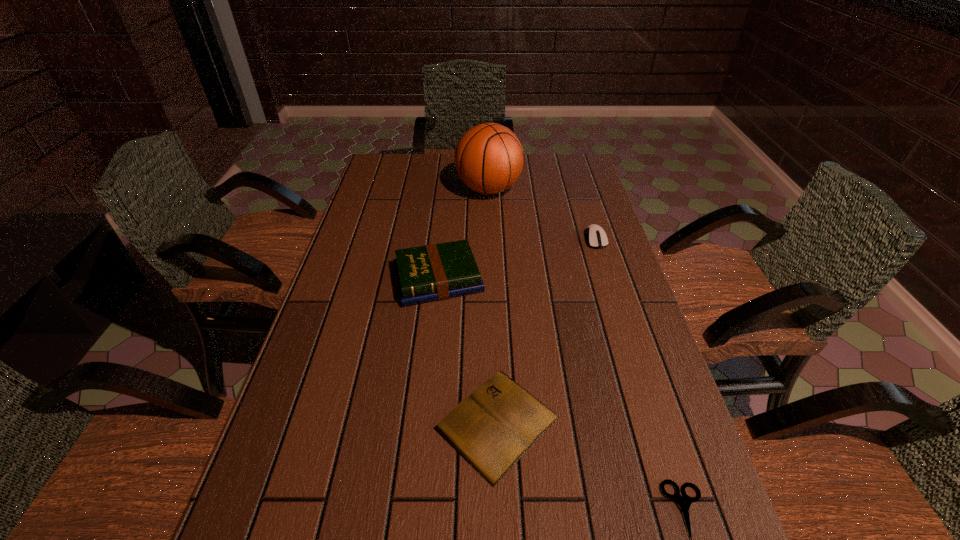
Image resolution: width=960 pixels, height=540 pixels. Identify the location of the tallest object. [x=489, y=158].

The width and height of the screenshot is (960, 540). I want to click on basketball, so click(489, 158).

The height and width of the screenshot is (540, 960). In order to click on the taller book in this screenshot , I will do `click(433, 272)`.

Where is `the third farthest object`? the third farthest object is located at coordinates (433, 272).

Locate an element on the screen. the second farthest object is located at coordinates (596, 237).

You are a GUI agent. You are given a task and a screenshot of the screen. Output one action in this format:
    pyautogui.click(x=<x>, y=<y>)
    Task: Click on the third shortest object
    
    Given the screenshot: What is the action you would take?
    pyautogui.click(x=596, y=237)

The image size is (960, 540). I want to click on the shorter book, so click(497, 424).

The width and height of the screenshot is (960, 540). What are the coordinates of `the nearer book` in the screenshot? It's located at (497, 424).

This screenshot has height=540, width=960. Find the location of `free space located on the front of the basketball`. free space located on the front of the basketball is located at coordinates (492, 282).

You are a GUI agent. You are given a task and a screenshot of the screen. Output one action in this format:
    pyautogui.click(x=<x>, y=<y>)
    Task: Click on the free location located on the right of the taller book
    
    Given the screenshot: What is the action you would take?
    pos(612,279)